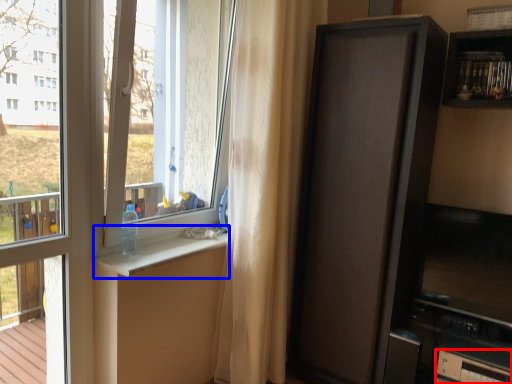
Question: Among these objects, which one is nearest to the camera, drawer (highlighted by a red box) or window sill (highlighted by a blue box)?

Choices:
 (A) drawer
 (B) window sill

Answer: (B)